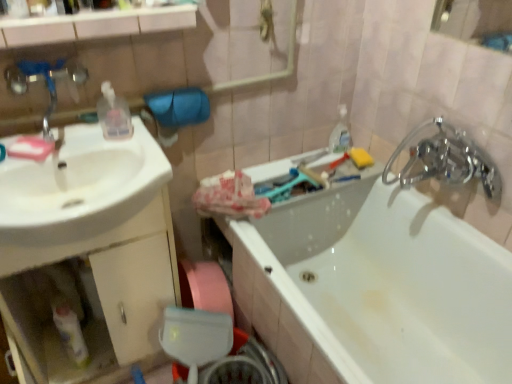
What is the approximate width of translucent plastic bottle at lower left, which appears as the 1th bottle when ordered from the bottom?

It is 3.31 inches.

Measure the distance between point (x=14, y=155) and camera.

Point (x=14, y=155) is 1.08 meters from camera.

The width and height of the screenshot is (512, 384). Describe the element at coordinates (45, 81) in the screenshot. I see `brushed metal faucet at upper left` at that location.

The width and height of the screenshot is (512, 384). What are the coordinates of `white glossy sink at left` in the screenshot? It's located at (80, 187).

You are a GUI agent. You are given a task and a screenshot of the screen. Output one action in this format:
    pyautogui.click(x=<x>, y=<y>)
    Task: Click on the transparent plastic bottle at upper left, the first bottle positioned from the top
    The height and width of the screenshot is (384, 512).
    Given the screenshot: What is the action you would take?
    pyautogui.click(x=114, y=114)

Is transparent plastic bottle at upper left, which ranks as the 2th bottle in bottom-to-top order, bigger or smaller than translucent plastic bottle at lower left, arranged as the second bottle when viewed from the top?

transparent plastic bottle at upper left, which ranks as the 2th bottle in bottom-to-top order, is smaller than translucent plastic bottle at lower left, arranged as the second bottle when viewed from the top.

Is transparent plastic bottle at upper left, the 2th bottle when ordered from left to right, far from translucent plastic bottle at lower left, which is the first bottle in back-to-front order?

No, transparent plastic bottle at upper left, the 2th bottle when ordered from left to right, is in close proximity to translucent plastic bottle at lower left, which is the first bottle in back-to-front order.

From a real-world perspective, which object rests below the other?

translucent plastic bottle at lower left, the 1th bottle positioned from the left.

Which object is positioned more to the right, transparent plastic bottle at upper left, the first bottle from the front, or brushed metal faucet at upper left?

Positioned to the right is transparent plastic bottle at upper left, the first bottle from the front.

Is transparent plastic bottle at upper left, acting as the first bottle starting from the right, closer to camera compared to brushed metal faucet at upper left?

No, transparent plastic bottle at upper left, acting as the first bottle starting from the right, is further to the viewer.

Does transparent plastic bottle at upper left, which ranks as the 2th bottle in bottom-to-top order, touch brushed metal faucet at upper left?

No, transparent plastic bottle at upper left, which ranks as the 2th bottle in bottom-to-top order, is not with brushed metal faucet at upper left.

Identify the location of the 1st bottle located beneath the brushed metal faucet at upper left (from a real-world perspective). (114, 114).

Is pink matte soap at left, which is the first soap in left-to-right order, far away from clear plastic bottle at upper right?

That's right, there is a large distance between pink matte soap at left, which is the first soap in left-to-right order, and clear plastic bottle at upper right.

Based on the photo, considering the sizes of objects pink matte soap at left, the 2th soap viewed from the right, and clear plastic bottle at upper right in the image provided, who is taller, pink matte soap at left, the 2th soap viewed from the right, or clear plastic bottle at upper right?

clear plastic bottle at upper right is taller.

Considering the sizes of objects pink matte soap at left, which is counted as the 1th soap, starting from the front, and clear plastic bottle at upper right in the image provided, who is thinner, pink matte soap at left, which is counted as the 1th soap, starting from the front, or clear plastic bottle at upper right?

clear plastic bottle at upper right.

Is brushed metal faucet at upper left outside of translucent plastic bottle at lower left, which is the first bottle in back-to-front order?

Yes, brushed metal faucet at upper left is not within translucent plastic bottle at lower left, which is the first bottle in back-to-front order.

Looking at this image, from a real-world perspective, relative to translucent plastic bottle at lower left, arranged as the second bottle when viewed from the top, is brushed metal faucet at upper left vertically above or below?

Clearly, from a real-world perspective, brushed metal faucet at upper left is above translucent plastic bottle at lower left, arranged as the second bottle when viewed from the top.

Is brushed metal faucet at upper left to the left of translucent plastic bottle at lower left, arranged as the second bottle when viewed from the top, from the viewer's perspective?

Incorrect, brushed metal faucet at upper left is not on the left side of translucent plastic bottle at lower left, arranged as the second bottle when viewed from the top.

From a real-world perspective, which is physically above, brushed metal faucet at upper left or pink matte soap at left, which is counted as the 1th soap, starting from the front?

In real-world perspective, brushed metal faucet at upper left is above.

Is brushed metal faucet at upper left not near pink matte soap at left, the 2th soap viewed from the right?

No, brushed metal faucet at upper left is in close proximity to pink matte soap at left, the 2th soap viewed from the right.

Does brushed metal faucet at upper left come in front of pink matte soap at left, which is counted as the 1th soap, starting from the front?

Yes, it is in front of pink matte soap at left, which is counted as the 1th soap, starting from the front.

How far apart are brushed metal faucet at upper left and pink matte soap at left, the 2th soap when ordered from back to front?

brushed metal faucet at upper left is 5.29 inches from pink matte soap at left, the 2th soap when ordered from back to front.

Is white glossy sink at left at the back of translucent plastic bottle at lower left, which appears as the 1th bottle when ordered from the bottom?

No, translucent plastic bottle at lower left, which appears as the 1th bottle when ordered from the bottom,'s orientation is not away from white glossy sink at left.

Are translucent plastic bottle at lower left, which appears as the 1th bottle when ordered from the bottom, and white glossy sink at left far apart?

translucent plastic bottle at lower left, which appears as the 1th bottle when ordered from the bottom, is actually quite close to white glossy sink at left.

Would you say translucent plastic bottle at lower left, acting as the second bottle starting from the right, is inside or outside white glossy sink at left?

translucent plastic bottle at lower left, acting as the second bottle starting from the right, is not inside white glossy sink at left, it's outside.

Is translucent plastic bottle at lower left, arranged as the second bottle when viewed from the top, in front of or behind white glossy sink at left in the image?

In the image, translucent plastic bottle at lower left, arranged as the second bottle when viewed from the top, appears behind white glossy sink at left.

In the scene shown: Is clear plastic bottle at upper right in front of transparent plastic bottle at upper left, the 2th bottle when ordered from left to right?

No.

Which of these two, clear plastic bottle at upper right or transparent plastic bottle at upper left, the second bottle in the back-to-front sequence, stands shorter?

Standing shorter between the two is transparent plastic bottle at upper left, the second bottle in the back-to-front sequence.

From the image's perspective, is clear plastic bottle at upper right located beneath transparent plastic bottle at upper left, which ranks as the 2th bottle in bottom-to-top order?

Actually, clear plastic bottle at upper right appears above transparent plastic bottle at upper left, which ranks as the 2th bottle in bottom-to-top order, in the image.

From a real-world perspective, who is located lower, clear plastic bottle at upper right or transparent plastic bottle at upper left, the second bottle in the back-to-front sequence?

In real-world perspective, clear plastic bottle at upper right is lower.

Locate an element on the screen. Image resolution: width=512 pixels, height=384 pixels. bottle that appears behind the transparent plastic bottle at upper left, which ranks as the 2th bottle in bottom-to-top order is located at coordinates click(69, 330).

This screenshot has width=512, height=384. What are the coordinates of `plumbing fixture above the transparent plastic bottle at upper left, the second bottle in the back-to-front sequence (from the image's perspective)` in the screenshot? It's located at (45, 81).

When comparing their distances from pink matte soap at left, which is the first soap in left-to-right order, does translucent plastic bottle at lower left, arranged as the second bottle when viewed from the front, or yellow sponge at upper right, the 2th soap when ordered from left to right, seem closer?

Based on the image, translucent plastic bottle at lower left, arranged as the second bottle when viewed from the front, appears to be nearer to pink matte soap at left, which is the first soap in left-to-right order.

When comparing their distances from clear plastic bottle at upper right, does transparent plastic bottle at upper left, the first bottle positioned from the top, or yellow sponge at upper right, the 2th soap when ordered from left to right, seem further?

transparent plastic bottle at upper left, the first bottle positioned from the top, is further to clear plastic bottle at upper right.

Based on their spatial positions, is yellow sponge at upper right, which is the 1th soap in back-to-front order, or brushed metal faucet at upper left further from white glossy bathtub at center?

Based on the image, brushed metal faucet at upper left appears to be further to white glossy bathtub at center.

When comparing their distances from transparent plastic bottle at upper left, the first bottle positioned from the top, does yellow sponge at upper right, which is the 1th soap in back-to-front order, or brushed metal faucet at upper left seem further?

The object further to transparent plastic bottle at upper left, the first bottle positioned from the top, is yellow sponge at upper right, which is the 1th soap in back-to-front order.

Estimate the real-world distances between objects in this image. Which object is further from clear plastic bottle at upper right, white glossy bathtub at center or translucent plastic bottle at lower left, which appears as the 1th bottle when ordered from the bottom?

Among the two, translucent plastic bottle at lower left, which appears as the 1th bottle when ordered from the bottom, is located further to clear plastic bottle at upper right.

Looking at the image, which one is located further to yellow sponge at upper right, which is the 1th soap in back-to-front order, chrome metallic faucet at upper right or brushed metal faucet at upper left?

The object further to yellow sponge at upper right, which is the 1th soap in back-to-front order, is brushed metal faucet at upper left.

Looking at the image, which one is located closer to white glossy bathtub at center, transparent plastic bottle at upper left, acting as the first bottle starting from the right, or white glossy sink at left?

Among the two, white glossy sink at left is located nearer to white glossy bathtub at center.

From the image, which object appears to be nearer to white glossy bathtub at center, chrome metallic faucet at upper right or clear plastic bottle at upper right?

The object closer to white glossy bathtub at center is chrome metallic faucet at upper right.

This screenshot has width=512, height=384. I want to click on bottle located between white glossy sink at left and yellow sponge at upper right, which is counted as the 1th soap, starting from the right, in the left-right direction, so click(x=114, y=114).

At what (x,y) coordinates should I click in order to perform the action: click on bottle between white glossy sink at left and white glossy bathtub at center in the horizontal direction. Please return your answer as a coordinate pair (x, y). Looking at the image, I should click on (114, 114).

Where is `toiletry between translucent plastic bottle at lower left, which is the first bottle in back-to-front order, and chrome metallic faucet at upper right from left to right`? toiletry between translucent plastic bottle at lower left, which is the first bottle in back-to-front order, and chrome metallic faucet at upper right from left to right is located at coordinates (340, 133).

Locate an element on the screen. Image resolution: width=512 pixels, height=384 pixels. bottle between translucent plastic bottle at lower left, which is the first bottle in back-to-front order, and chrome metallic faucet at upper right from left to right is located at coordinates (114, 114).